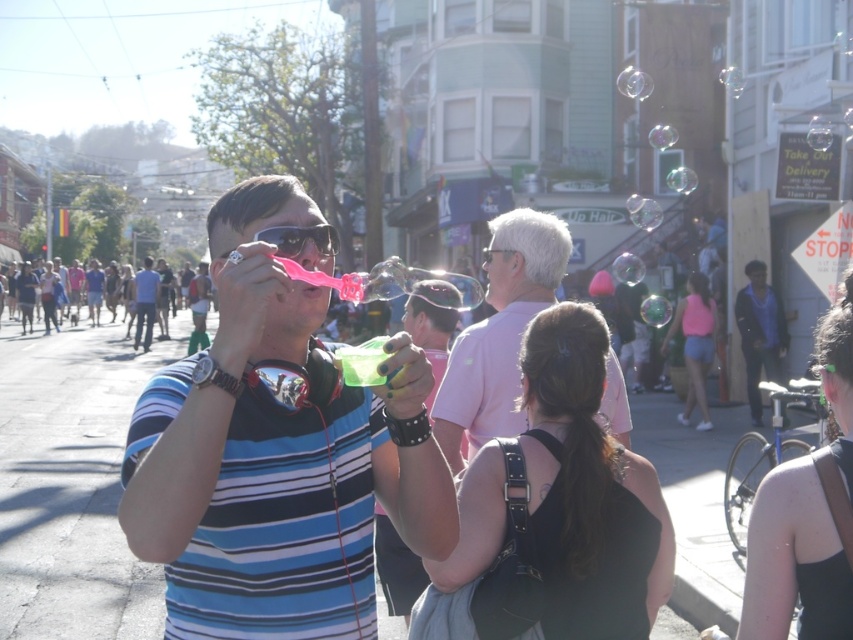
Question: Is matte black goggles at center bigger than clear plastic goggles at center?

Choices:
 (A) no
 (B) yes

Answer: (A)

Question: Which point is farther from the camera taking this photo?

Choices:
 (A) (351, 458)
 (B) (509, 340)
 (C) (497, 524)
 (D) (498, 250)

Answer: (D)

Question: Considering the relative positions of matte black goggles at center and blue striped shirt at center in the image provided, where is matte black goggles at center located with respect to blue striped shirt at center?

Choices:
 (A) right
 (B) left

Answer: (A)

Question: Based on their relative distances, which object is nearer to the striped cotton shirt at center?

Choices:
 (A) black fabric hair at upper right
 (B) pink fabric shorts at lower right
 (C) clear plastic goggles at center

Answer: (A)

Question: Which of these objects is positioned farthest from the black fabric hair at upper right?

Choices:
 (A) matte black goggles at center
 (B) pink matte bubble wand at center
 (C) striped cotton shirt at center

Answer: (B)

Question: Does pink matte bubble wand at center appear under matte black goggles at center?

Choices:
 (A) no
 (B) yes

Answer: (B)